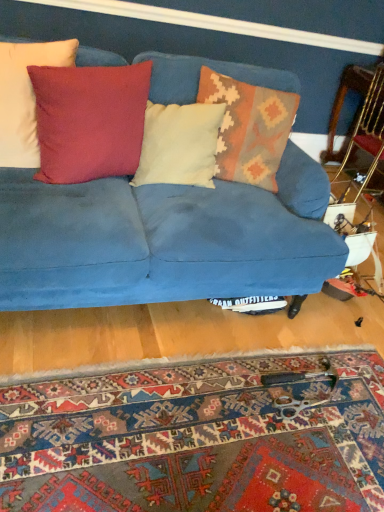
Question: Is velvet blue couch at center taller than matte red pillow at upper left, which is counted as the first pillow, starting from the left?

Choices:
 (A) yes
 (B) no

Answer: (A)

Question: Is matte red pillow at upper left, positioned as the fourth pillow in right-to-left order, a part of velvet blue couch at center?

Choices:
 (A) no
 (B) yes

Answer: (B)

Question: Is matte red pillow at upper left, which is counted as the first pillow, starting from the left, at the back of velvet blue couch at center?

Choices:
 (A) yes
 (B) no

Answer: (A)

Question: Is velvet blue couch at center at the right side of matte red pillow at upper left, positioned as the fourth pillow in right-to-left order?

Choices:
 (A) yes
 (B) no

Answer: (A)

Question: Considering the relative sizes of velvet blue couch at center and matte red pillow at upper left, positioned as the fourth pillow in right-to-left order, in the image provided, is velvet blue couch at center bigger than matte red pillow at upper left, positioned as the fourth pillow in right-to-left order,?

Choices:
 (A) yes
 (B) no

Answer: (A)

Question: Considering the relative sizes of velvet blue couch at center and matte red pillow at upper left, which is counted as the first pillow, starting from the left, in the image provided, is velvet blue couch at center shorter than matte red pillow at upper left, which is counted as the first pillow, starting from the left,?

Choices:
 (A) no
 (B) yes

Answer: (A)

Question: Does carpet with intricate patterns at lower center have a lesser width compared to knitted wool pillow at center, the 1th pillow viewed from the right?

Choices:
 (A) yes
 (B) no

Answer: (B)

Question: Would you consider carpet with intricate patterns at lower center to be distant from knitted wool pillow at center, which ranks as the fourth pillow in left-to-right order?

Choices:
 (A) no
 (B) yes

Answer: (B)

Question: From a real-world perspective, is carpet with intricate patterns at lower center positioned over knitted wool pillow at center, which ranks as the fourth pillow in left-to-right order, based on gravity?

Choices:
 (A) yes
 (B) no

Answer: (B)

Question: Can you confirm if carpet with intricate patterns at lower center is taller than knitted wool pillow at center, the 1th pillow viewed from the right?

Choices:
 (A) yes
 (B) no

Answer: (B)

Question: Is the surface of carpet with intricate patterns at lower center in direct contact with knitted wool pillow at center, the 1th pillow viewed from the right?

Choices:
 (A) no
 (B) yes

Answer: (A)

Question: Does carpet with intricate patterns at lower center have a greater width compared to knitted wool pillow at center, which ranks as the fourth pillow in left-to-right order?

Choices:
 (A) no
 (B) yes

Answer: (B)

Question: Does suede-like red pillow at upper left, the second pillow in the left-to-right sequence, have a smaller size compared to wooden armchair at right?

Choices:
 (A) no
 (B) yes

Answer: (B)